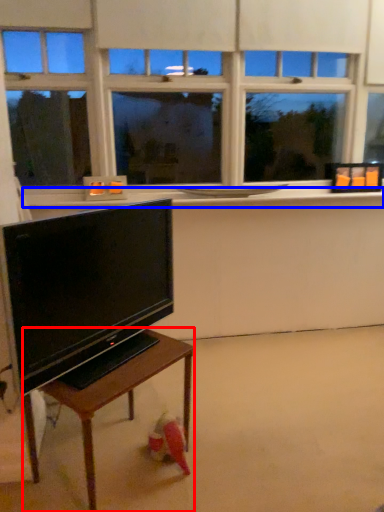
Question: Among these objects, which one is nearest to the camera, table (highlighted by a red box) or window sill (highlighted by a blue box)?

Choices:
 (A) table
 (B) window sill

Answer: (A)